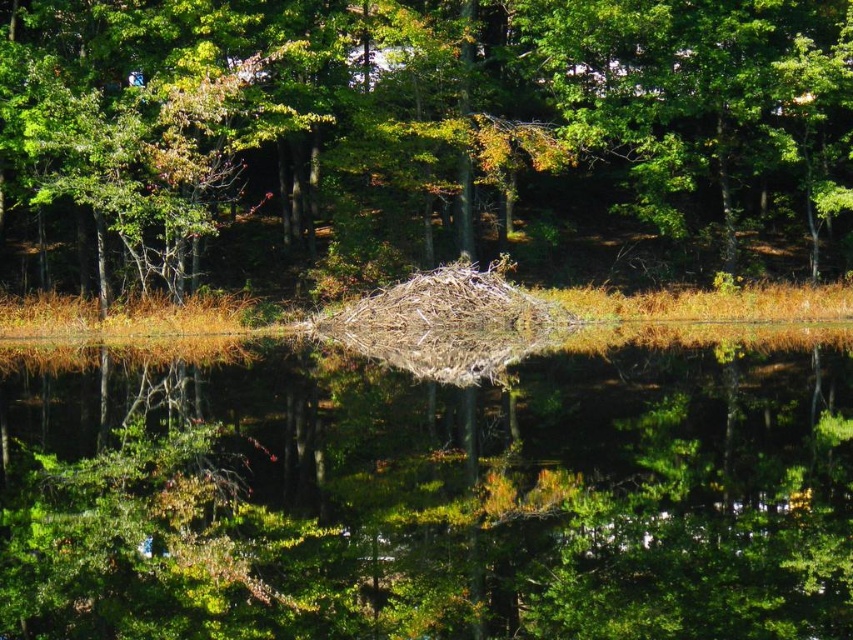
Which is in front, point (724, 61) or point (403, 614)?

Point (403, 614) is in front.

Between point (161, 193) and point (469, 438), which one is positioned behind?

The point (161, 193) is more distant.

Which is behind, point (538, 19) or point (273, 371)?

The point (538, 19) is behind.

The height and width of the screenshot is (640, 853). I want to click on brown textured nest at center, so click(x=421, y=138).